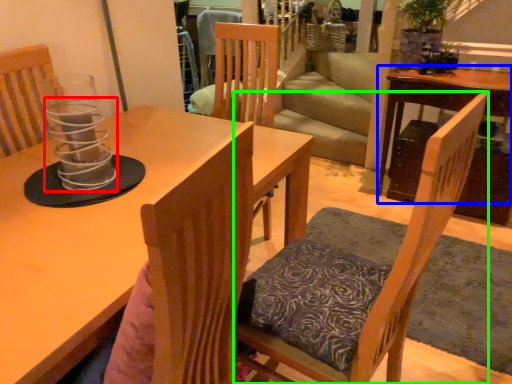
Question: Which object is positioned farthest from candle holder (highlighted by a red box)? Select from table (highlighted by a blue box) and chair (highlighted by a green box).

Choices:
 (A) table
 (B) chair

Answer: (A)